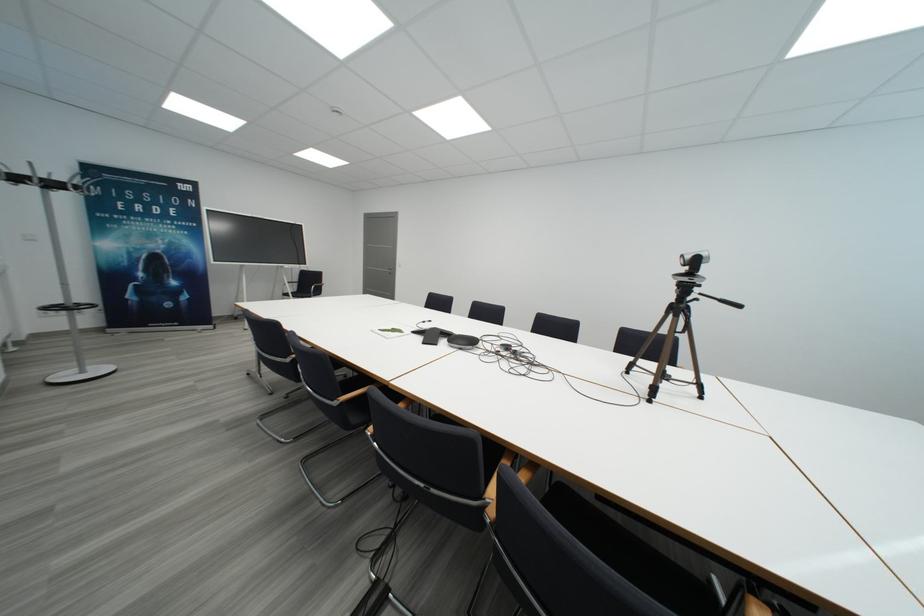
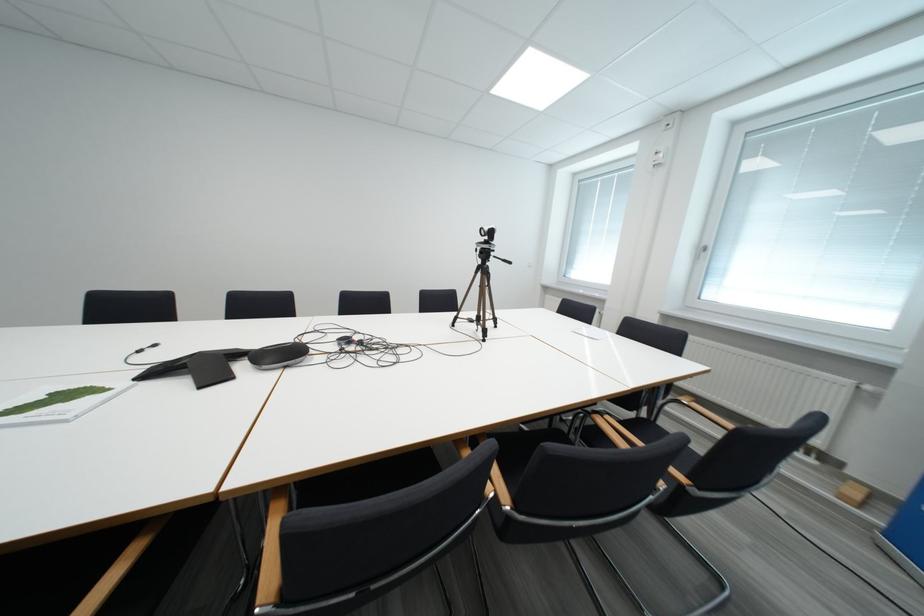
Question: How did the camera likely rotate?

Choices:
 (A) Left
 (B) Right
 (C) Up
 (D) Down

Answer: (B)